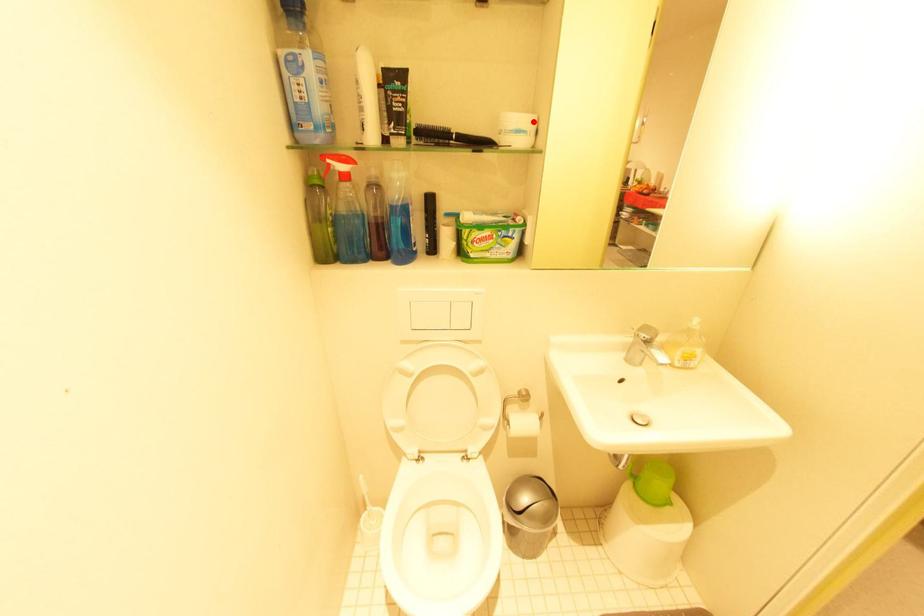
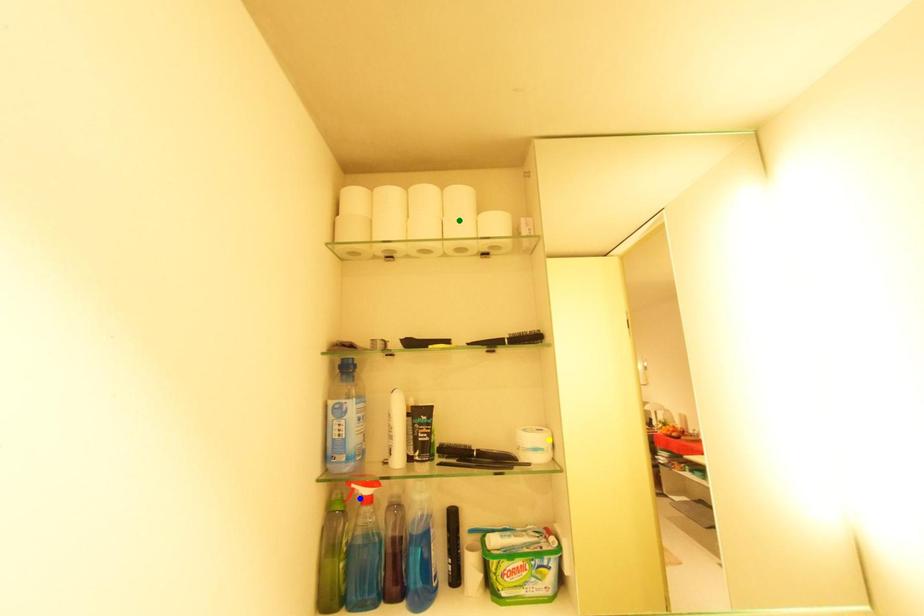
Question: I am providing you with two images of the same scene from different viewpoints. A red point is marked on the first image. You are given multiple points on the second image. Which mark in image 2 goes with the point in image 1?

Choices:
 (A) green point
 (B) yellow point
 (C) blue point

Answer: (B)